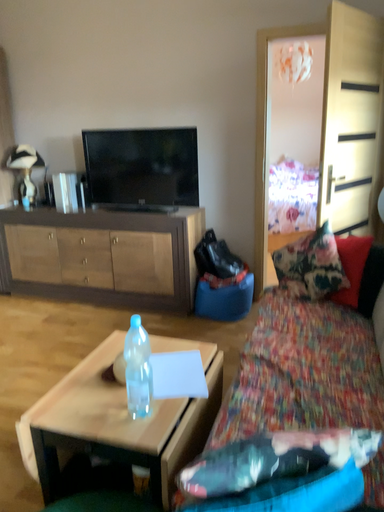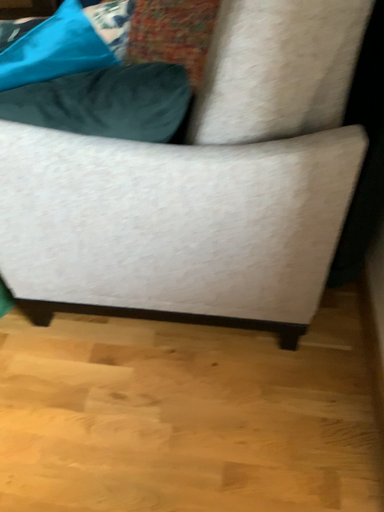
Question: How did the camera likely rotate when shooting the video?

Choices:
 (A) rotated left
 (B) rotated right

Answer: (B)